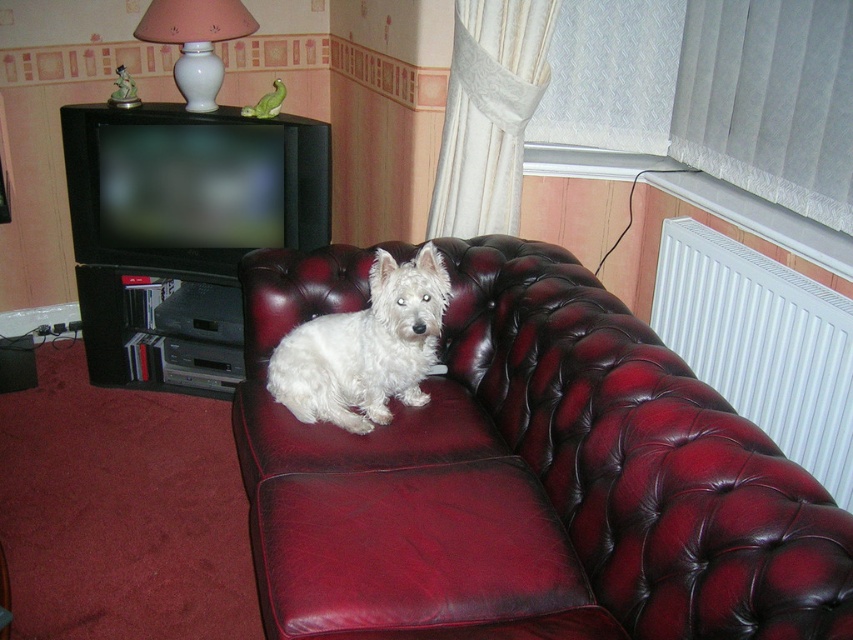
Consider the image. Between white fur dog at center and white ceramic lamp at upper center, which one has more height?

Standing taller between the two is white fur dog at center.

Image resolution: width=853 pixels, height=640 pixels. Describe the element at coordinates (364, 348) in the screenshot. I see `white fur dog at center` at that location.

This screenshot has height=640, width=853. Describe the element at coordinates (364, 348) in the screenshot. I see `white fur dog at center` at that location.

Locate an element on the screen. Image resolution: width=853 pixels, height=640 pixels. white fur dog at center is located at coordinates (364, 348).

Is white plastic radiator at upper right thinner than white fur dog at center?

Yes.

Who is lower down, white plastic radiator at upper right or white fur dog at center?

white fur dog at center is lower down.

Between point (698, 300) and point (413, 310), which one is positioned behind?

Positioned behind is point (698, 300).

This screenshot has width=853, height=640. I want to click on white plastic radiator at upper right, so click(761, 344).

Can you confirm if burgundy leather couch at center is positioned to the right of white fur dog at center?

Correct, you'll find burgundy leather couch at center to the right of white fur dog at center.

Between point (361, 608) and point (328, 332), which one is positioned behind?

The point (328, 332) is more distant.

This screenshot has width=853, height=640. I want to click on burgundy leather couch at center, so click(x=526, y=476).